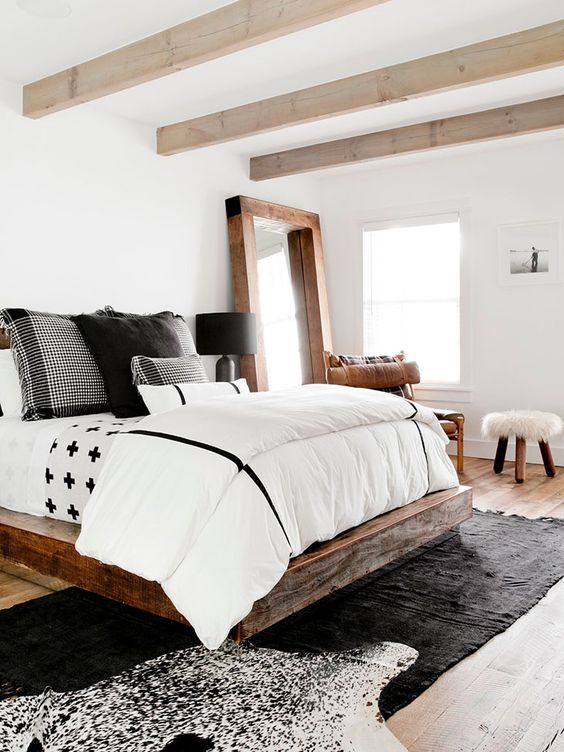
The image size is (564, 752). I want to click on black carpet, so click(x=497, y=562).